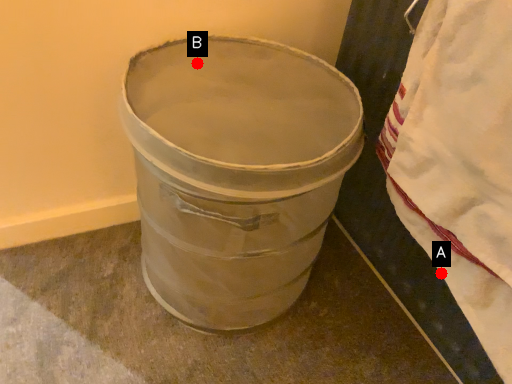
Question: Two points are circled on the image, labeled by A and B beside each circle. Which point is farther to the camera?

Choices:
 (A) A is further
 (B) B is further

Answer: (B)